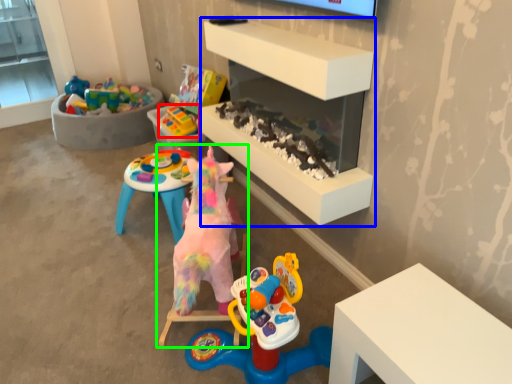
Question: Based on their relative distances, which object is nearer to toy (highlighted by a red box)? Choose from shelf (highlighted by a blue box) and toy (highlighted by a green box).

Choices:
 (A) shelf
 (B) toy

Answer: (A)